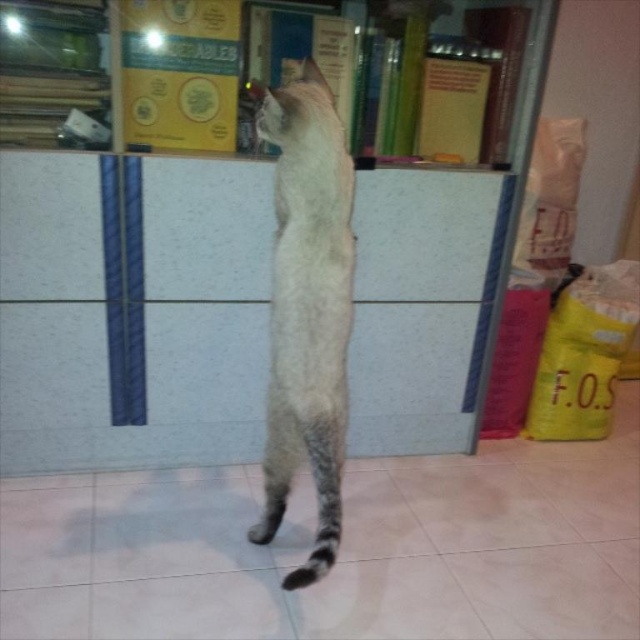
Question: Which point is farther to the camera?

Choices:
 (A) light gray fur cat at center
 (B) gray striped tail at lower center

Answer: (A)

Question: Can you confirm if white textured bookshelf at upper center is positioned below gray striped tail at lower center?

Choices:
 (A) no
 (B) yes

Answer: (A)

Question: Can you confirm if white textured bookshelf at upper center is positioned above light gray fur cat at center?

Choices:
 (A) no
 (B) yes

Answer: (A)

Question: Is light gray fur cat at center closer to camera compared to gray striped tail at lower center?

Choices:
 (A) yes
 (B) no

Answer: (B)

Question: Which of the following is the closest to the observer?

Choices:
 (A) gray striped tail at lower center
 (B) white textured bookshelf at upper center
 (C) light gray fur cat at center

Answer: (A)

Question: Estimate the real-world distances between objects in this image. Which object is farther from the gray striped tail at lower center?

Choices:
 (A) light gray fur cat at center
 (B) white textured bookshelf at upper center

Answer: (B)